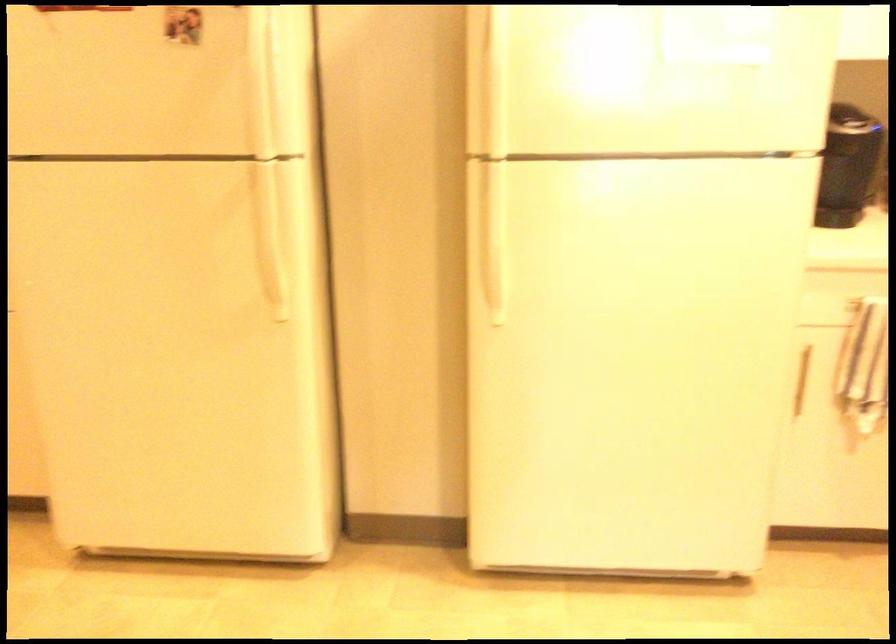
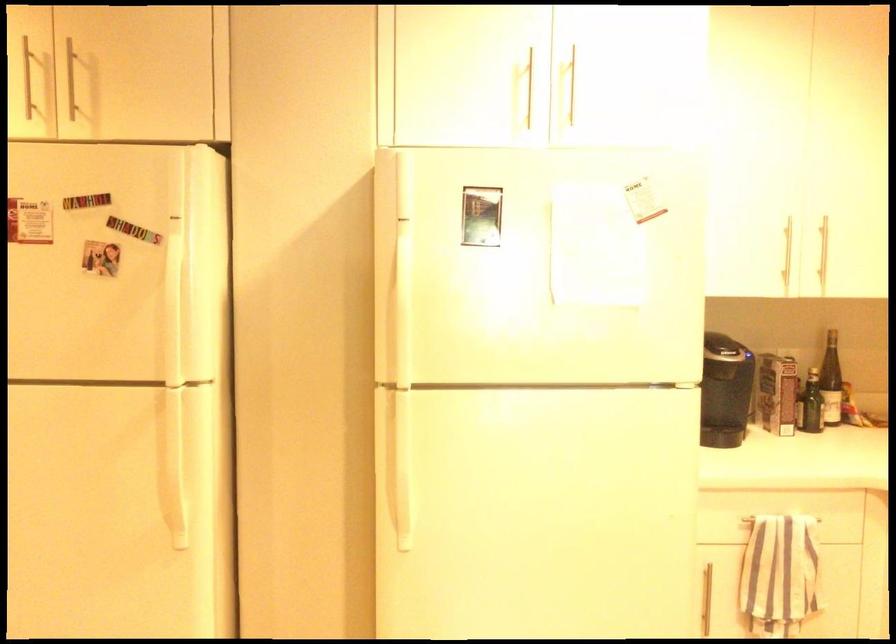
Where in the second image is the point corresponding to [492,232] from the first image?

(398, 460)